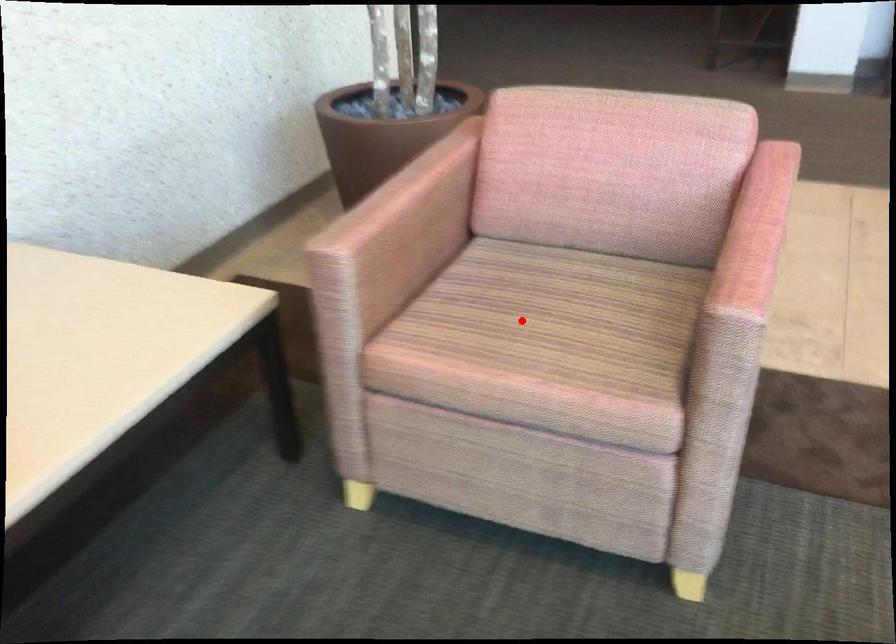
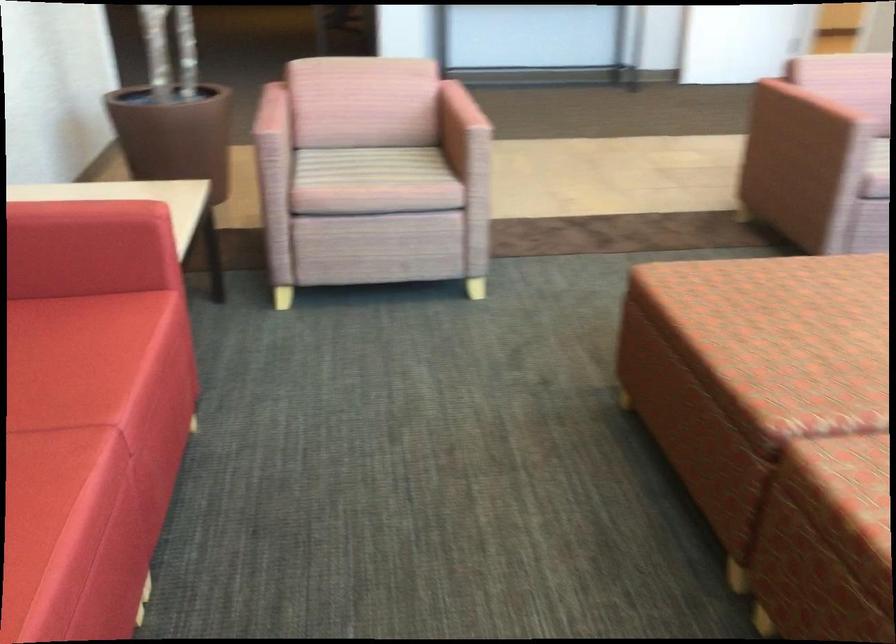
Locate, in the second image, the point that corresponds to the highlighted location in the first image.

(365, 166)